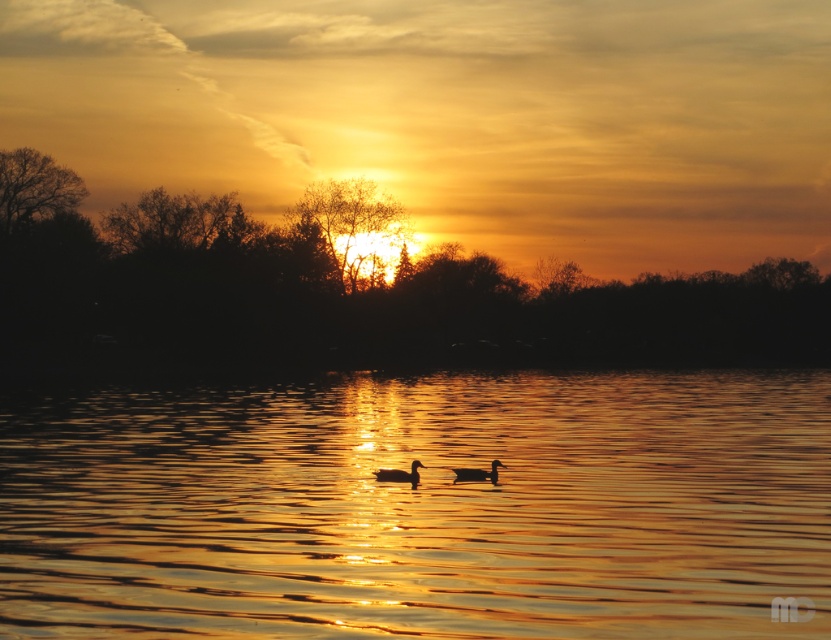
Between point (96, 584) and point (477, 472), which one is positioned behind?

The point (477, 472) is more distant.

Does point (119, 429) come behind point (499, 460)?

That is True.

Who is more distant from viewer, (530,449) or (475,476)?

Point (530,449)

You are a GUI agent. You are given a task and a screenshot of the screen. Output one action in this format:
    pyautogui.click(x=<x>, y=<y>)
    Task: Click on the glistening golden water at center
    This screenshot has height=640, width=831.
    Given the screenshot: What is the action you would take?
    pyautogui.click(x=421, y=508)

Who is positioned more to the left, glistening golden water at center or brown matte duck at center?

From the viewer's perspective, brown matte duck at center appears more on the left side.

What do you see at coordinates (421, 508) in the screenshot?
I see `glistening golden water at center` at bounding box center [421, 508].

Where is `glistening golden water at center`? This screenshot has height=640, width=831. glistening golden water at center is located at coordinates (421, 508).

Is brown matte duck at center to the left of matte black duck at center from the viewer's perspective?

Yes, brown matte duck at center is to the left of matte black duck at center.

Is brown matte duck at center thinner than matte black duck at center?

Yes.

Is point (411, 480) positioned after point (484, 472)?

No, (411, 480) is closer to viewer.

Locate an element on the screen. This screenshot has height=640, width=831. brown matte duck at center is located at coordinates (399, 474).